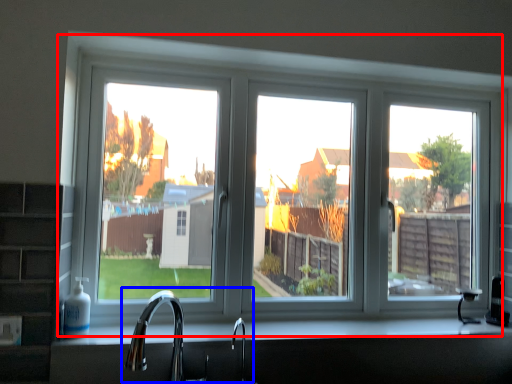
Question: Which object appears closest to the camera in this image, window (highlighted by a red box) or sink (highlighted by a blue box)?

Choices:
 (A) window
 (B) sink

Answer: (B)